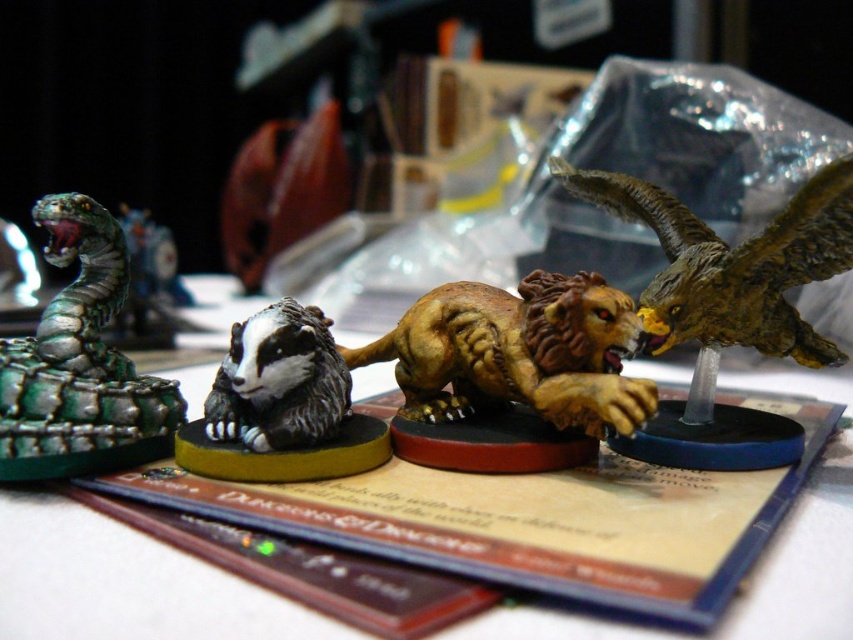
Can you confirm if green metallic snake at left is bigger than black matte badger at center?

Yes, green metallic snake at left is bigger than black matte badger at center.

Looking at this image, between green metallic snake at left and black matte badger at center, which one is positioned lower?

Positioned lower is black matte badger at center.

Image resolution: width=853 pixels, height=640 pixels. Describe the element at coordinates (80, 364) in the screenshot. I see `green metallic snake at left` at that location.

What are the coordinates of `green metallic snake at left` in the screenshot? It's located at (80, 364).

Between point (784, 266) and point (296, 381), which one is positioned in front?

Positioned in front is point (296, 381).

Which of these two, shiny gold eagle at upper right or black matte badger at center, stands shorter?

Standing shorter between the two is black matte badger at center.

What do you see at coordinates (732, 262) in the screenshot? I see `shiny gold eagle at upper right` at bounding box center [732, 262].

At what (x,y) coordinates should I click in order to perform the action: click on shiny gold eagle at upper right. Please return your answer as a coordinate pair (x, y). Image resolution: width=853 pixels, height=640 pixels. Looking at the image, I should click on coord(732,262).

Describe the element at coordinates (80, 364) in the screenshot. The image size is (853, 640). I see `green metallic snake at left` at that location.

This screenshot has width=853, height=640. I want to click on green metallic snake at left, so click(80, 364).